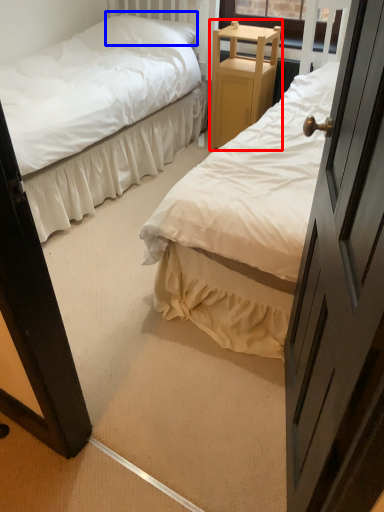
Question: Which point is closer to the camera, furniture (highlighted by a red box) or pillow (highlighted by a blue box)?

Choices:
 (A) furniture
 (B) pillow

Answer: (A)